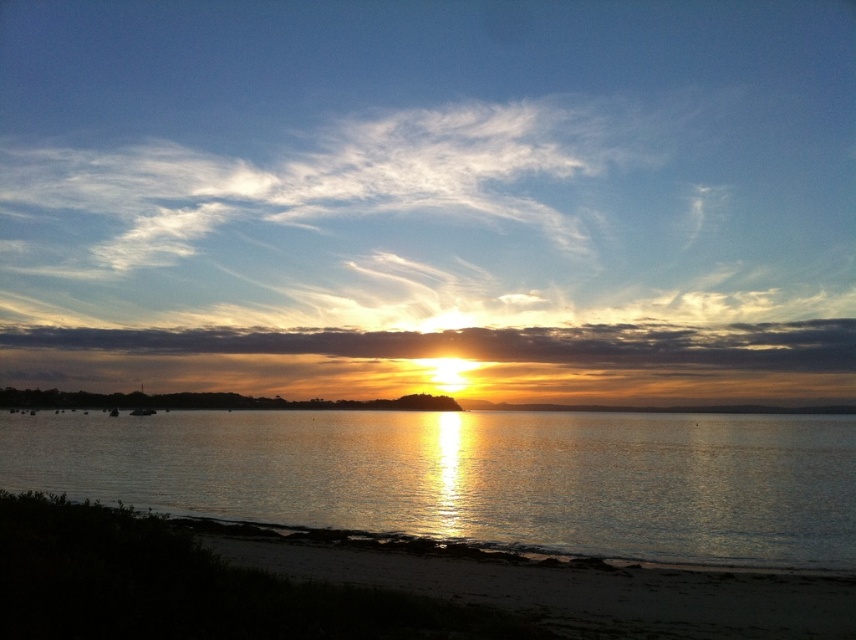
You are standing on the sandy beach at lower left and want to walk to the glistening water at center. Which direction should you head towards?

The glistening water at center is positioned on the left side of sandy beach at lower left, so you should head towards the left to reach it.